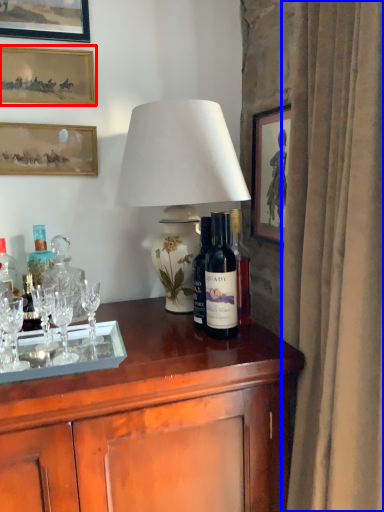
Question: Among these objects, which one is farthest to the camera, picture frame (highlighted by a red box) or curtain (highlighted by a blue box)?

Choices:
 (A) picture frame
 (B) curtain

Answer: (A)